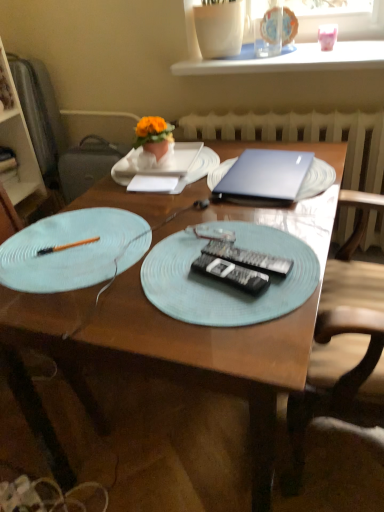
This screenshot has width=384, height=512. I want to click on free location above blue textured placemat at center, the 3th plate viewed from the back (from a real-world perspective), so click(x=231, y=263).